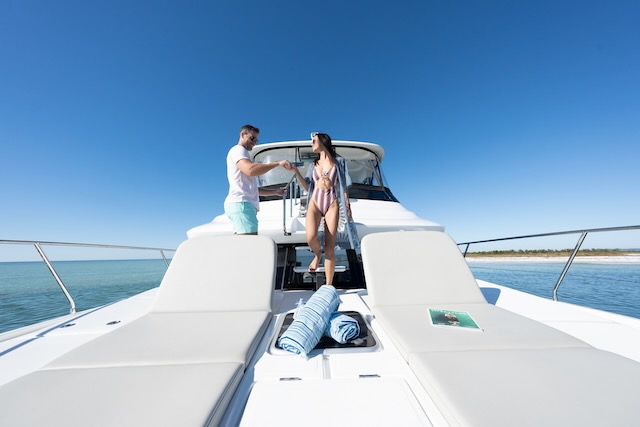
Locate an element on the screen. The image size is (640, 427). towel is located at coordinates (301, 329), (340, 327).